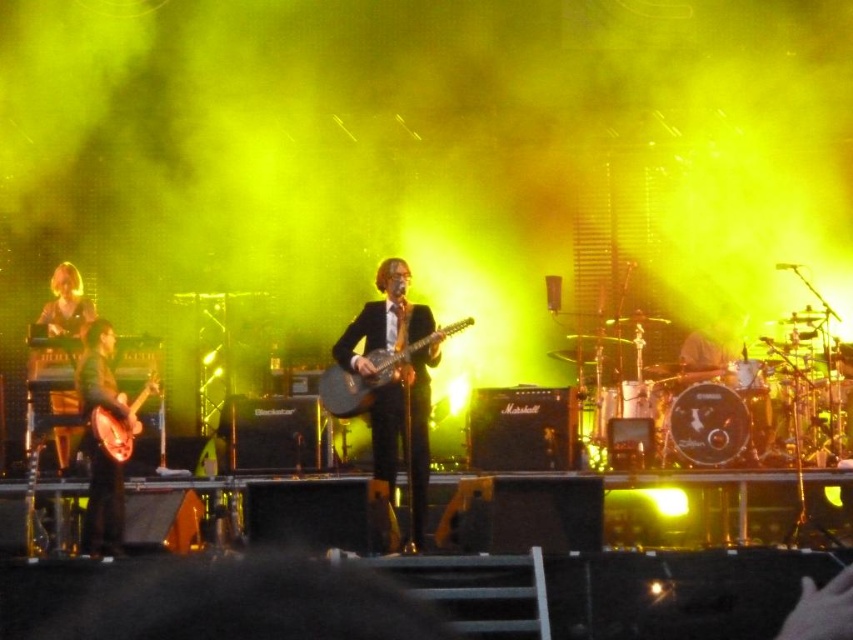
In the scene shown: You are a photographer at the back of the venue and want to capture both the black glossy suit at center and golden hair at left in a single shot. Considering their positions, which one will appear taller in the photo?

The black glossy suit at center appears taller in the photo because it has a greater height compared to the golden hair at left as stated in the description.

You are a stagehand setting up a new microphone stand. The stand requires 1 meter of space to the left and right of its placement. You want to place it between the shiny silver drum at center and the shiny metallic guitar at center. Is there enough space between them to accommodate the microphone stand?

The shiny silver drum at center might be wider than the shiny metallic guitar at center, so the total space between them may not be sufficient to fit the microphone stand which requires 1 meter of space on each side. Check the actual distance before placing the stand.